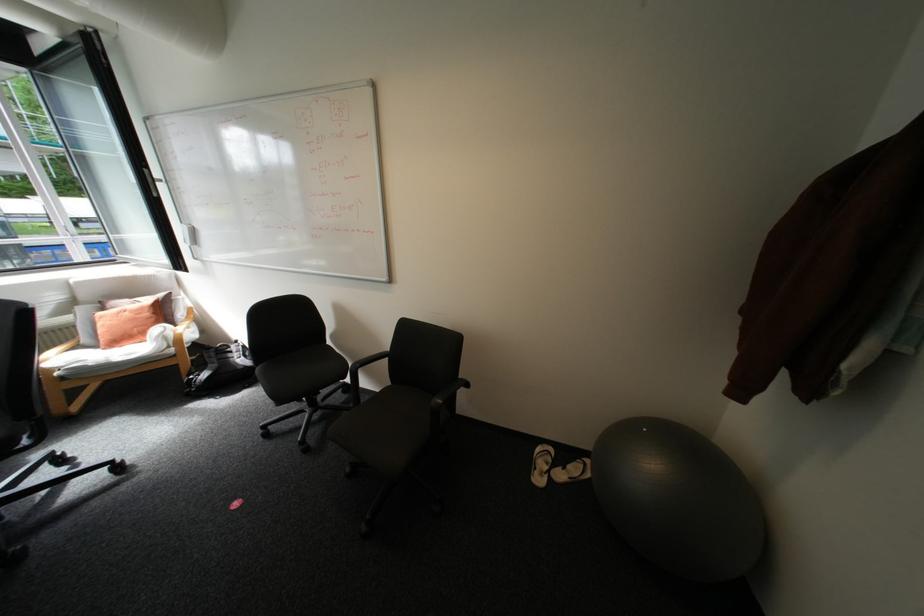
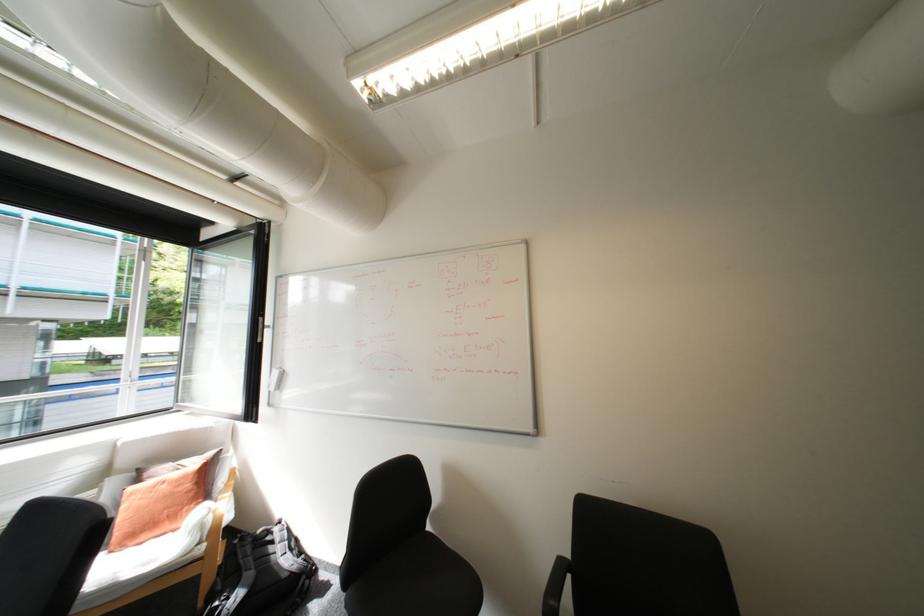
Question: How did the camera likely rotate?

Choices:
 (A) Left
 (B) Right
 (C) Up
 (D) Down

Answer: (C)